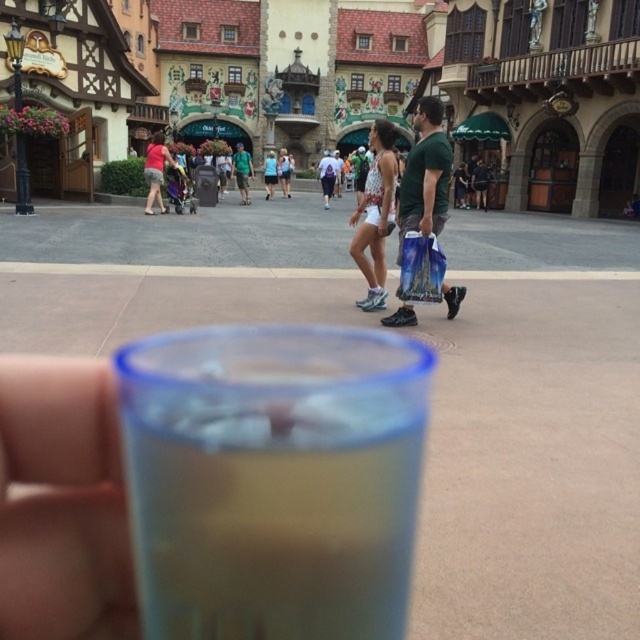
You are at the theme park and holding both the translucent plastic cup at center and the matte red shirt at center. Which object has a smaller width?

The translucent plastic cup at center has a smaller width than the matte red shirt at center.